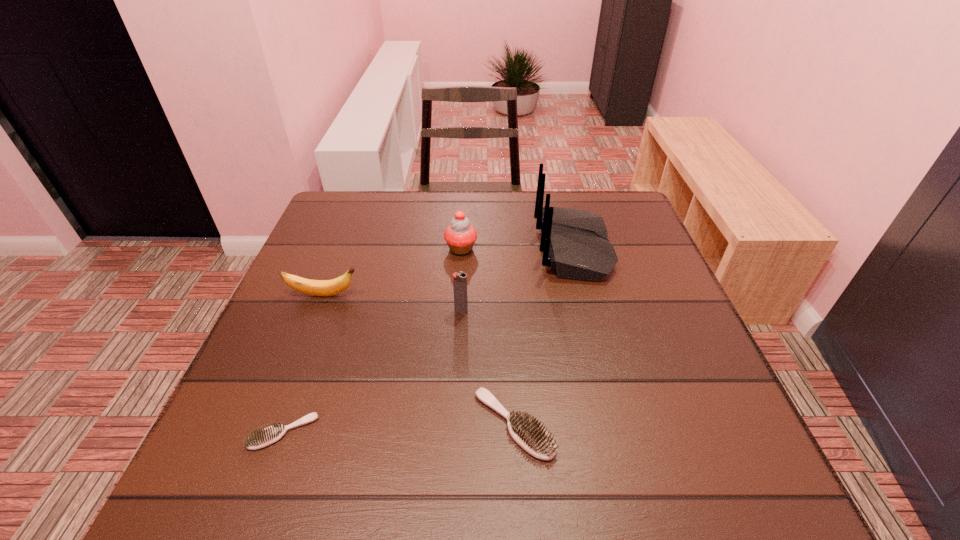
Find the location of a particular element. The height and width of the screenshot is (540, 960). banana at the left edge is located at coordinates (335, 286).

Where is `object that is at the right edge`? object that is at the right edge is located at coordinates (574, 242).

Where is `object positioned at the near left corner`? The height and width of the screenshot is (540, 960). object positioned at the near left corner is located at coordinates (260, 438).

I want to click on object that is at the far right corner, so click(x=574, y=242).

Where is `blank space at the far edge`? blank space at the far edge is located at coordinates (489, 201).

Identify the location of free spot at the left edge of the desktop. The width and height of the screenshot is (960, 540). (310, 394).

Identify the location of vacant space at the right edge. This screenshot has height=540, width=960. coord(693,390).

The height and width of the screenshot is (540, 960). Find the location of `vacant space at the far left corner of the desktop`. vacant space at the far left corner of the desktop is located at coordinates (369, 216).

Where is `vacant area between the router and the shorter scrubbing brush`? vacant area between the router and the shorter scrubbing brush is located at coordinates (428, 340).

The height and width of the screenshot is (540, 960). In order to click on empty location between the shorter scrubbing brush and the tallest object in this screenshot , I will do `click(428, 340)`.